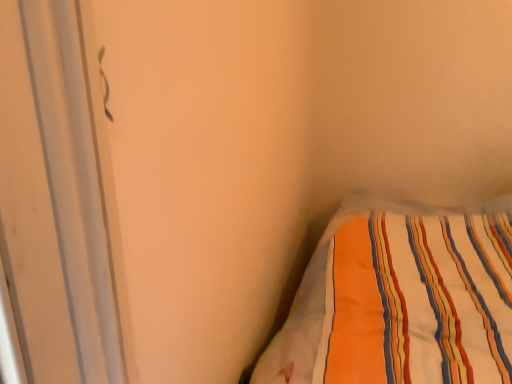
This screenshot has height=384, width=512. I want to click on striped fabric bed at lower right, so click(x=401, y=298).

What do you see at coordinates (401, 298) in the screenshot? The height and width of the screenshot is (384, 512). I see `striped fabric bed at lower right` at bounding box center [401, 298].

Measure the distance between striped fabric bed at lower right and camera.

35.04 inches.

Locate an element on the screen. The width and height of the screenshot is (512, 384). striped fabric bed at lower right is located at coordinates (401, 298).